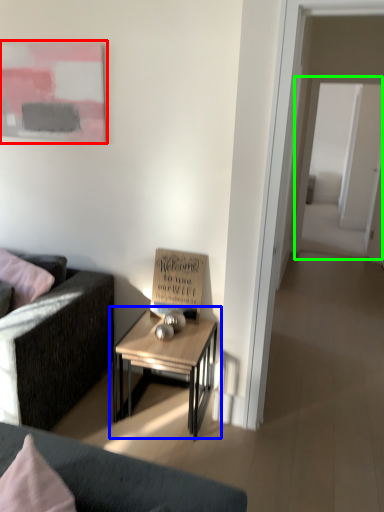
Question: Estimate the real-world distances between objects in this image. Which object is farther from picture frame (highlighted by a red box), table (highlighted by a blue box) or glass door (highlighted by a green box)?

Choices:
 (A) table
 (B) glass door

Answer: (B)